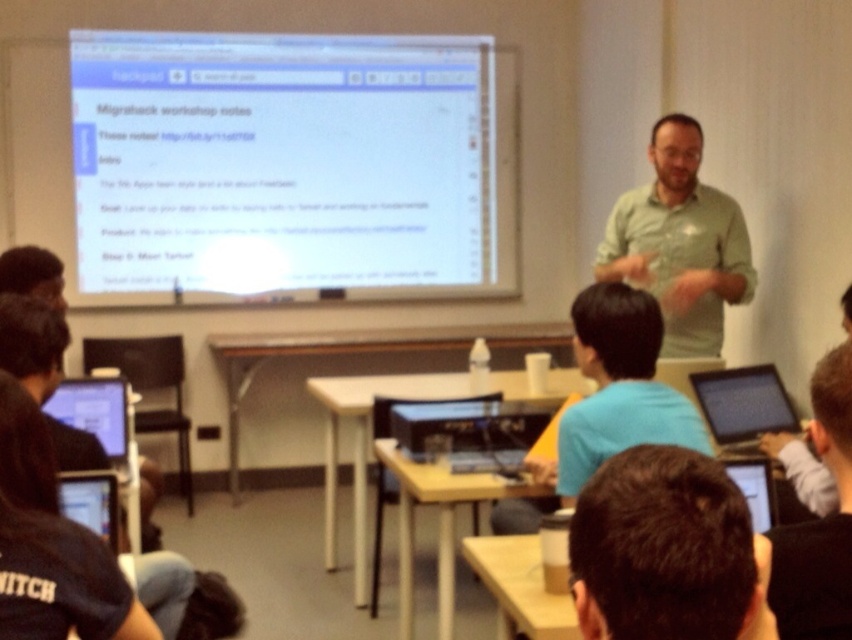
You are a student in the classroom and want to take a photo of the projection screen. The camera you are using has a minimum focus distance of 40 inches. Can you focus on the point at coordinates point at point (649, 474) without moving closer?

The point at point (649, 474) is 38.89 inches away from the camera, which is less than the minimum focus distance of 40 inches. Therefore, the camera cannot focus on that point without moving closer.

You are a student in the classroom. You need to hand in your assignment to the professor wearing a blue shirt at center. However, there is a black glossy laptop at lower right blocking your path. Can you walk directly to the professor without moving the laptop?

The blue shirt at center is in front of the black glossy laptop at lower right, meaning the laptop is behind the professor. Therefore, you can walk directly to the professor without needing to move the laptop since the laptop is not blocking the path.